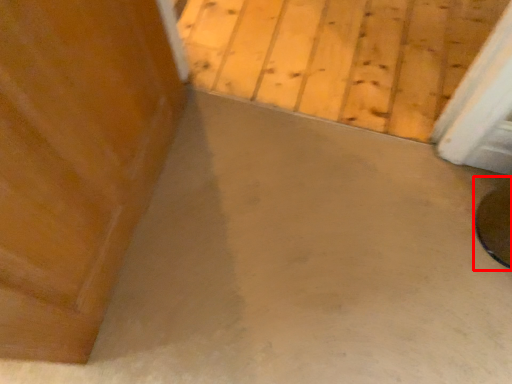
Question: From the image's perspective, what is the correct spatial relationship of round table (annotated by the red box) in relation to concrete?

Choices:
 (A) above
 (B) below

Answer: (B)